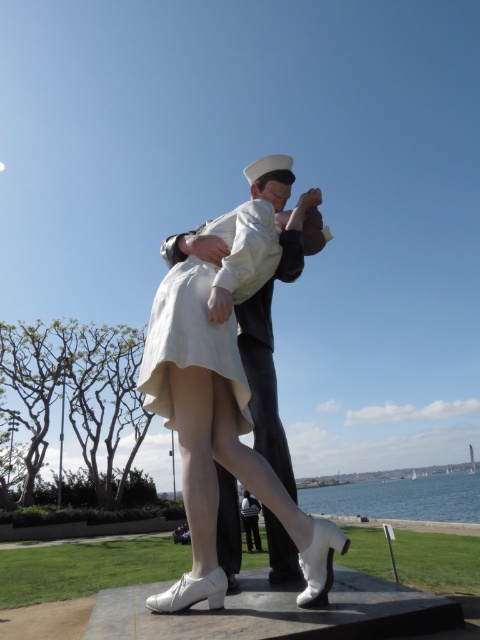
You are a photographer standing at a certain position and want to capture the white glossy statue at center in your shot. The recommended distance for optimal clarity is 8 feet. Is the current distance sufficient?

The white glossy statue at center and camera are 7.56 feet apart from each other, which is slightly less than the recommended 8 feet. The current distance is sufficient for optimal clarity.

You are standing in front of the statue of the sailor and woman. There are two points marked on the statue. One is at coordinates point (204, 298) and the other at point (456, 508). Which point is closer to you?

Point (204, 298) is closer to the viewer than point (456, 508).